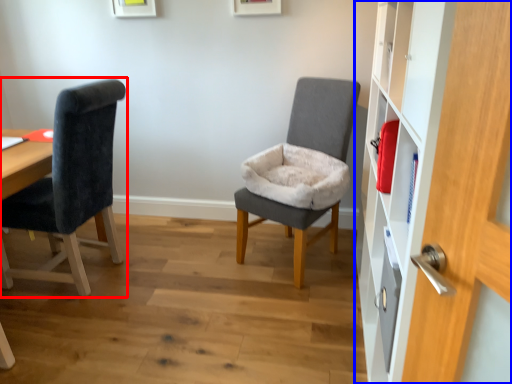
Question: Among these objects, which one is nearest to the camera, chair (highlighted by a red box) or dresser (highlighted by a blue box)?

Choices:
 (A) chair
 (B) dresser

Answer: (B)